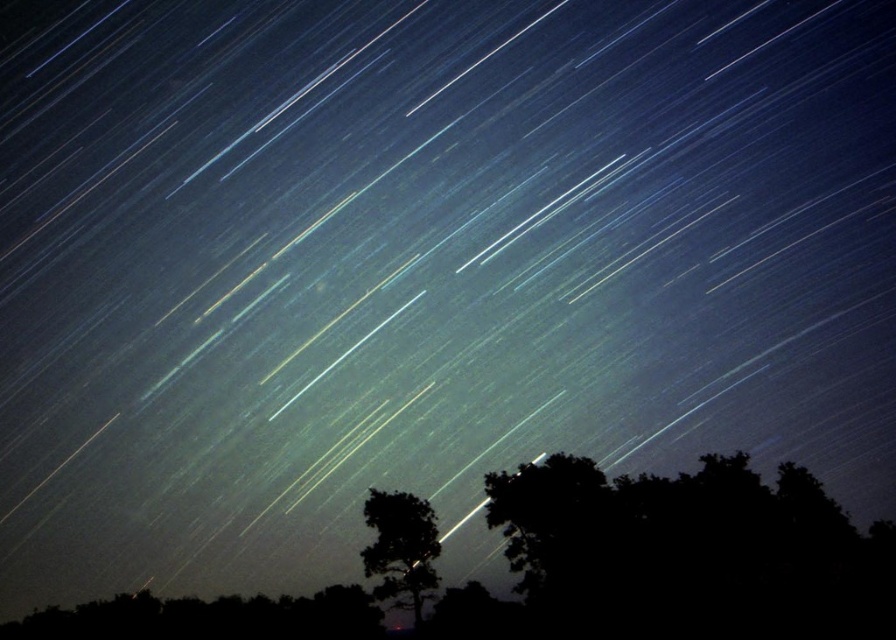
Question: Does black silhouetted tree at lower right lie in front of silhouette tree at center?

Choices:
 (A) yes
 (B) no

Answer: (A)

Question: Can you confirm if black silhouetted tree at lower right is wider than silhouette tree at center?

Choices:
 (A) yes
 (B) no

Answer: (A)

Question: Does black silhouetted tree at lower right lie in front of silhouette tree at center?

Choices:
 (A) no
 (B) yes

Answer: (B)